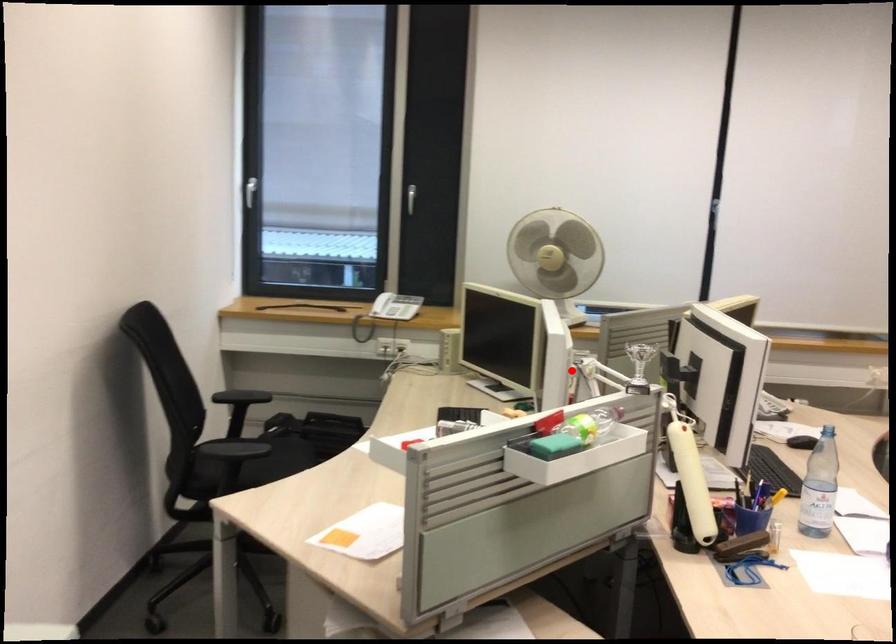
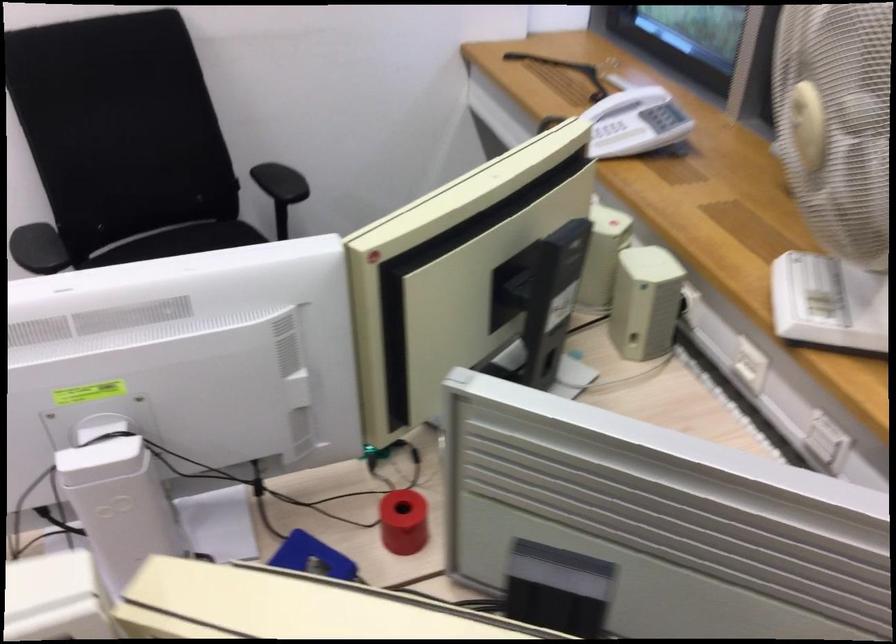
The point at the highlighted location is marked in the first image. Where is the corresponding point in the second image?

(118, 500)